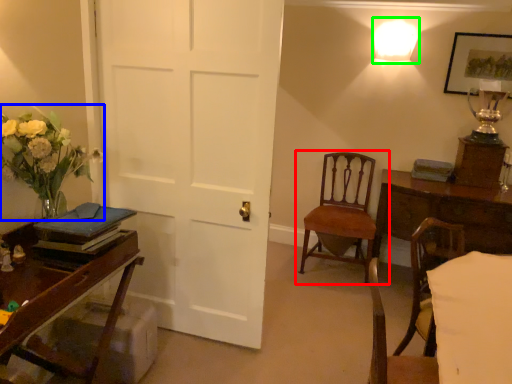
Question: Which is farther away from chair (highlighted by a red box)? floral arrangement (highlighted by a blue box) or lighting (highlighted by a green box)?

Choices:
 (A) floral arrangement
 (B) lighting

Answer: (A)